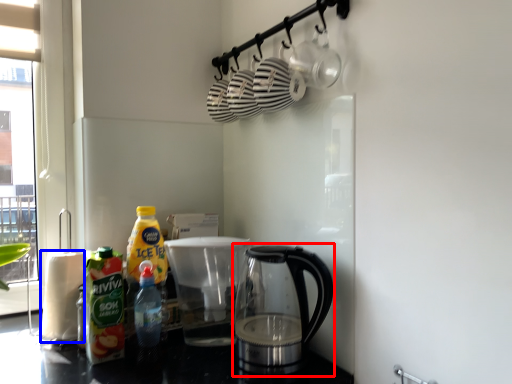
Question: Among these objects, which one is nearest to the camera, kettle (highlighted by a red box) or paper towel (highlighted by a blue box)?

Choices:
 (A) kettle
 (B) paper towel

Answer: (A)